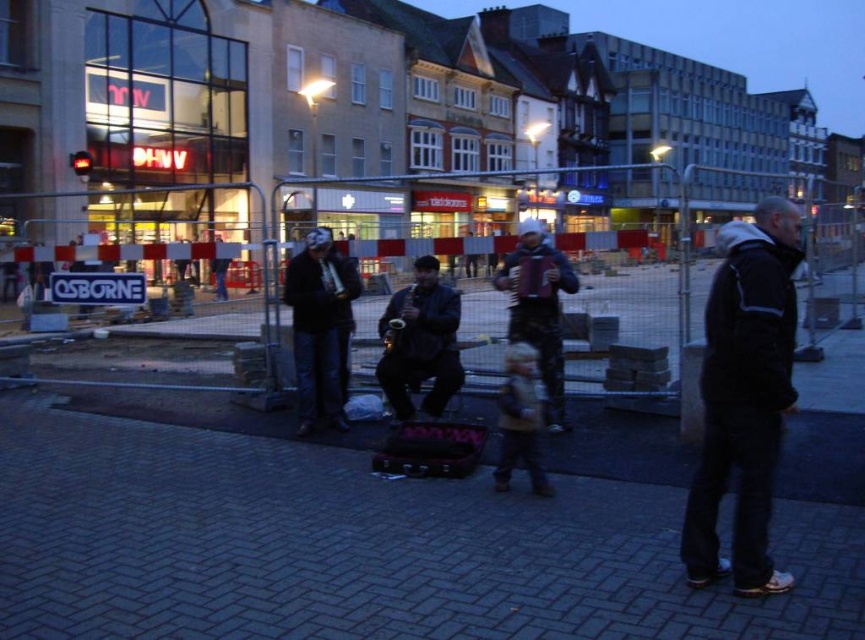
You are a photographer standing at the edge of the plaza. You want to take a photo of the dark blue leather jacket at center without including the dark brick pavement at lower center in the frame. Is this possible based on their positions?

The dark brick pavement at lower center is positioned under the dark blue leather jacket at center, so it would be challenging to capture the jacket without including the pavement in the frame since the pavement is directly beneath it.

You are a street performer who wants to set up a small stand between the dark brick pavement at lower center and the dark blue leather jacket at center. Can you fit a stand that is 1 meter wide in that space?

The dark brick pavement at lower center is wider than the dark blue leather jacket at center. Since the pavement is wider, the space between them might accommodate the 1m stand, but exact dimensions aren

You are a photographer standing in the plaza and want to capture a photo of the two musicians wearing the matte black mask at center and the dark blue leather jacket at center. Since you want to focus on their faces, which object should you zoom in on more to ensure it appears larger in the photo?

The matte black mask at center has a smaller size compared to the dark blue leather jacket at center, so you should zoom in more on the matte black mask at center to make it appear larger in the photo.